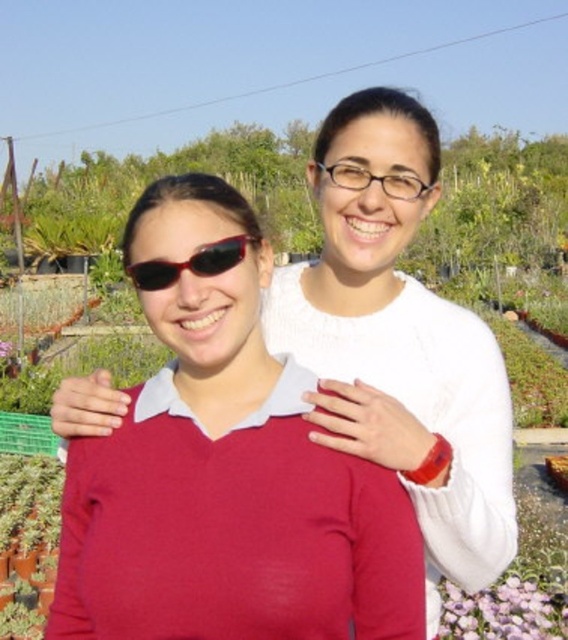
Question: Which of the following is the farthest from the observer?

Choices:
 (A) black plastic sunglasses at center
 (B) matte red sweater at center

Answer: (A)

Question: Can you confirm if purple matte flower at lower right is positioned above black plastic sunglasses at center?

Choices:
 (A) yes
 (B) no

Answer: (B)

Question: Is matte red sweater at center wider than purple matte flower at lower right?

Choices:
 (A) yes
 (B) no

Answer: (A)

Question: Can you confirm if matte red sweater at center is wider than purple matte flower at lower right?

Choices:
 (A) no
 (B) yes

Answer: (B)

Question: Which object is the farthest from the black plastic sunglasses at center?

Choices:
 (A) purple matte flower at lower right
 (B) matte red sweater at center

Answer: (A)

Question: Which of the following is the farthest from the observer?

Choices:
 (A) matte red sweater at center
 (B) black plastic sunglasses at center

Answer: (B)